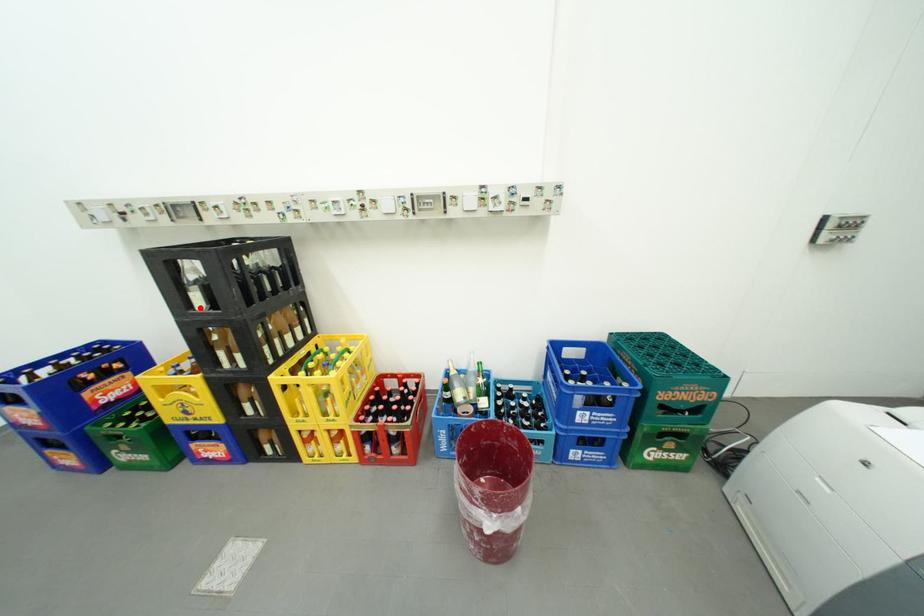
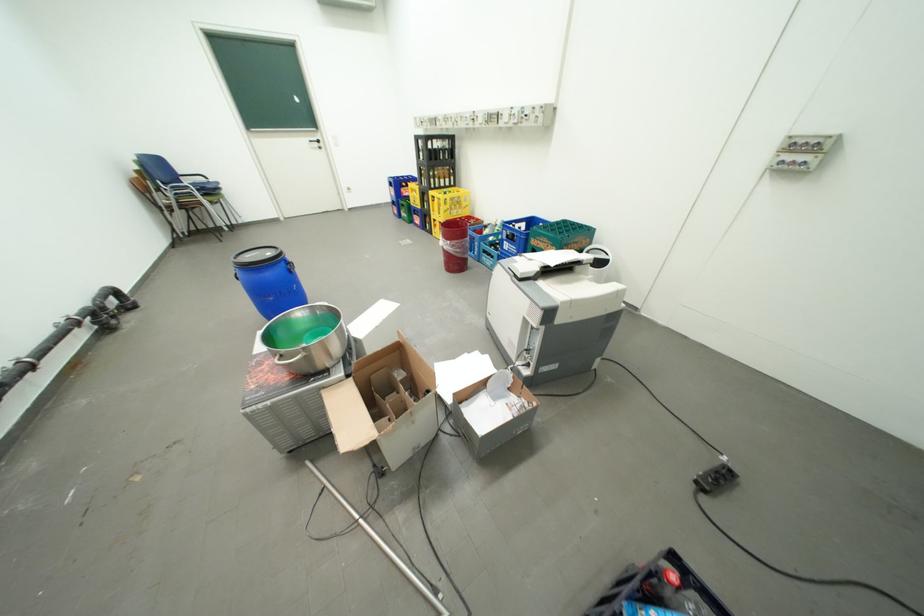
Find the pixel in the second image that matches the highlighted location in the first image.

(430, 159)